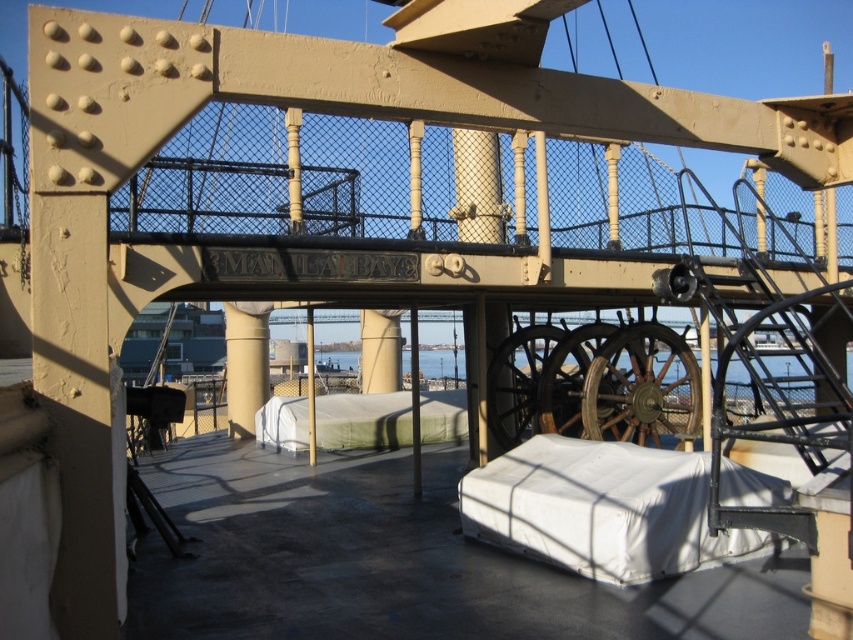
You are standing at the front of the ship deck and want to reach the white fabric ramp at center. Which direction should you move to reach it?

Since the white fabric ramp at center is located at coordinates approximately 0.658 on the x and 0.427 on the y axis, you should move towards the center of the deck from the front to reach it.